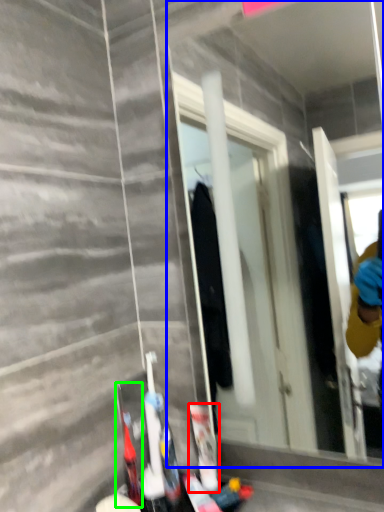
Question: Which is farther away from toiletry (highlighted by a red box)? mirror (highlighted by a blue box) or toiletry (highlighted by a green box)?

Choices:
 (A) mirror
 (B) toiletry

Answer: (A)